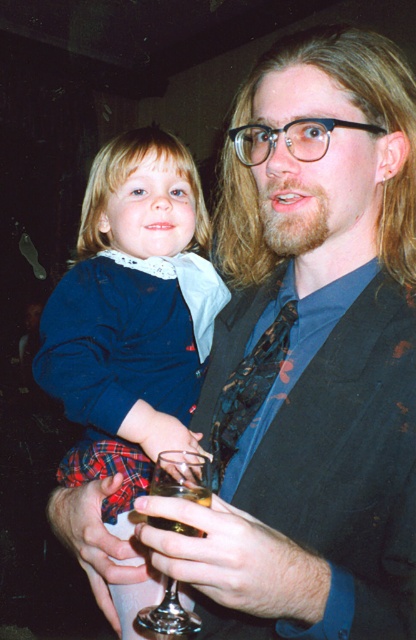
Question: Does matte blue dress at center appear on the left side of shiny black tie at center?

Choices:
 (A) yes
 (B) no

Answer: (A)

Question: Which point appears closest to the camera in this image?

Choices:
 (A) (230, 388)
 (B) (205, 496)
 (C) (188, 196)

Answer: (B)

Question: Can you confirm if shiny black tie at center is bigger than translucent glass at center?

Choices:
 (A) no
 (B) yes

Answer: (B)

Question: Observing the image, what is the correct spatial positioning of matte blue dress at center in reference to clear glass wine at center?

Choices:
 (A) left
 (B) right

Answer: (A)

Question: Which object appears farthest from the camera in this image?

Choices:
 (A) shiny black tie at center
 (B) clear glass wine at center
 (C) matte blue dress at center
 (D) translucent glass at center

Answer: (A)

Question: Among these objects, which one is farthest from the camera?

Choices:
 (A) matte blue dress at center
 (B) translucent glass at center
 (C) clear glass wine at center
 (D) shiny black tie at center

Answer: (D)